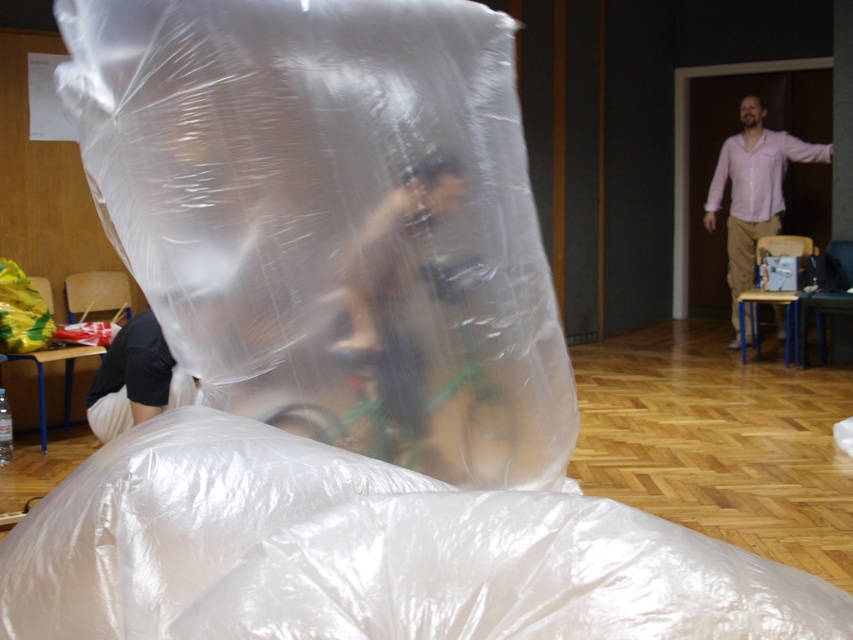
Looking at this image, you are trying to navigate through the room to reach the pink shirt at right without touching the green metallic bicycle at center. Which direction should you move relative to the bicycle?

Since the green metallic bicycle at center is to the left of the pink shirt at right, you should move to the right of the bicycle to reach the pink shirt at right without touching it.

You are a photographer trying to capture a unique shot. You see the transparent plastic bag at center and the brown leather jacket at center. Which object should you focus on if you want to photograph the one that is positioned to the left?

The transparent plastic bag at center is to the left of the brown leather jacket at center, so you should focus on the transparent plastic bag at center.